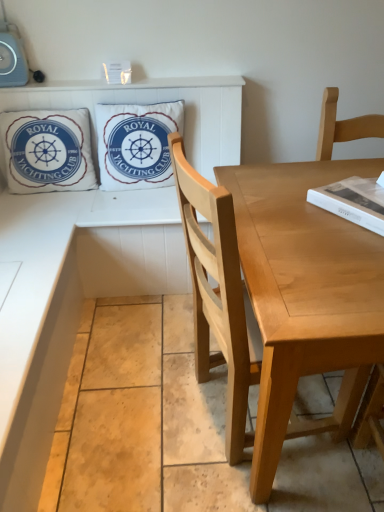
I want to click on free space below white matte book at upper right (from a real-world perspective), so click(361, 209).